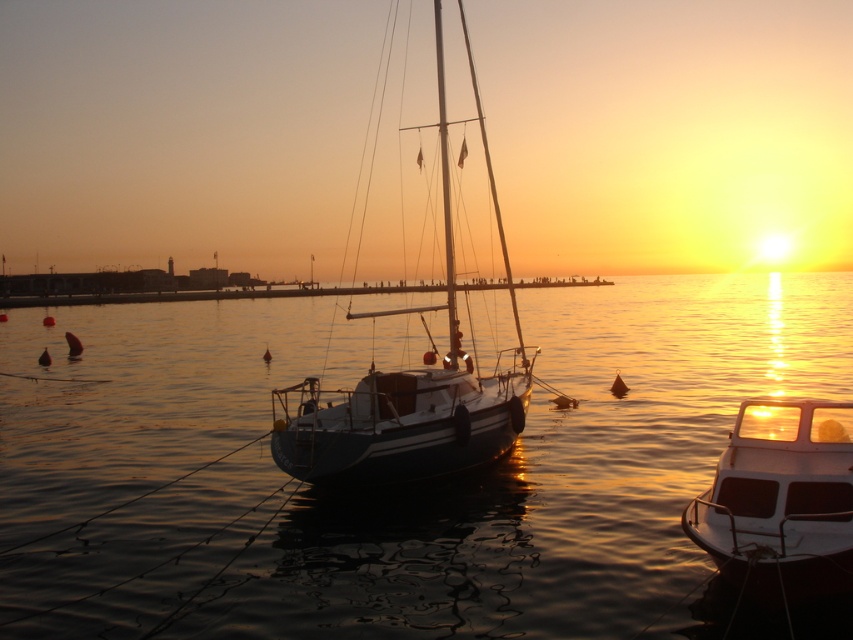
You are standing at the edge of the marina and notice the glossy water at center and the white glossy sailboat at center. Which object appears taller from your viewpoint?

The white glossy sailboat at center appears taller than the glossy water at center because the sailboat is taller according to the description.